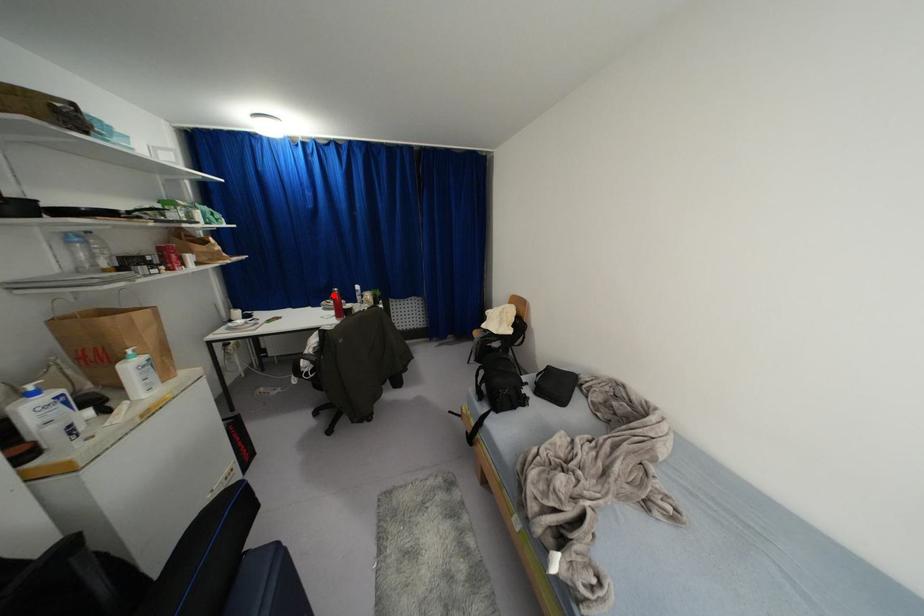
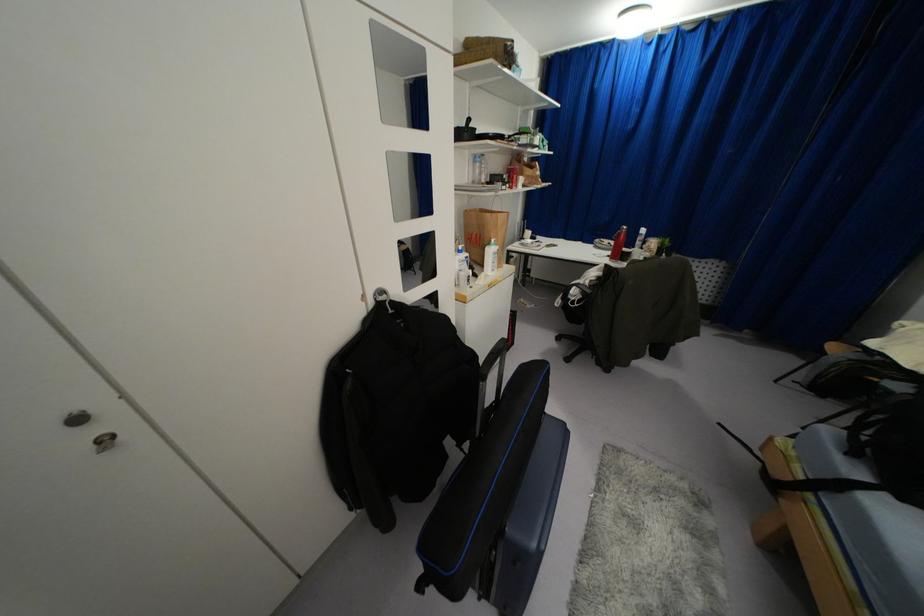
The point at the highlighted location is marked in the first image. Where is the corresponding point in the second image?

(618, 233)